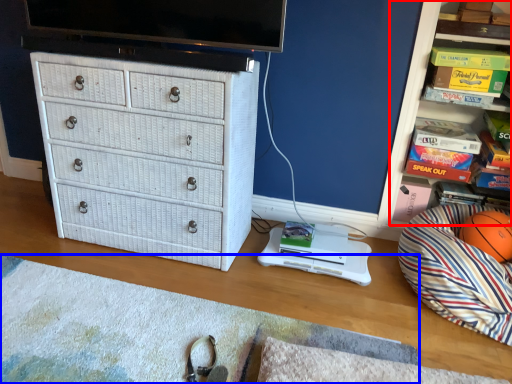
Question: Which object appears farthest to the camera in this image, shelf (highlighted by a red box) or mat (highlighted by a blue box)?

Choices:
 (A) shelf
 (B) mat

Answer: (A)